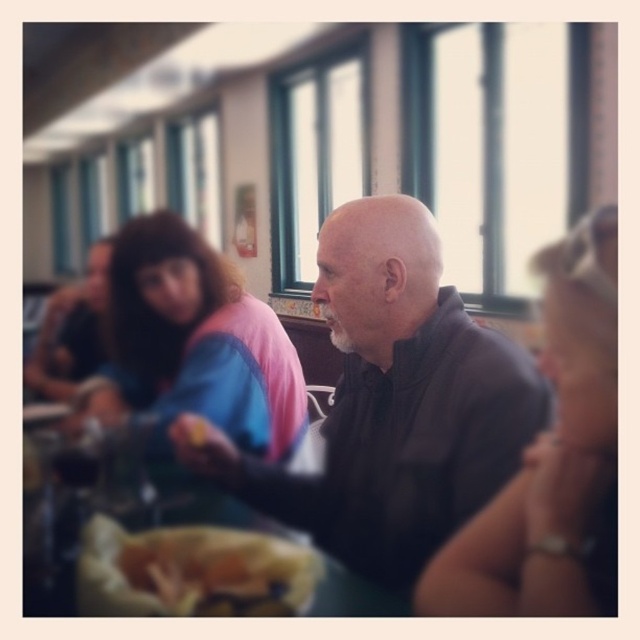
You are standing in a restaurant and want to place a small decoration exactly at the point marked as point (x=440, y=556). If your hand is 30 inches away from that point, will you be able to reach it without moving your hand closer?

The distance of point (x=440, y=556) from viewer is 35.57 inches. Since your hand is 30 inches away from the point, you need to move your hand 5.57 inches closer to reach it.

You are a waiter in a restaurant. You need to place a 30 cm long tray between the dark brown leather jacket at center and the golden crispy bread at center. Can you fit the tray there?

The distance between the dark brown leather jacket at center and the golden crispy bread at center is 25.25 centimeters, which is shorter than the 30 cm tray. Therefore, the tray cannot fit in that space.

Based on the photo, you are a photographer trying to capture a closeup of the golden crispy bread at center. However, the dark brown leather jacket at center is blocking your view. Can you move the jacket to get a clear shot of the bread?

The dark brown leather jacket at center is further to the viewer than golden crispy bread at center, so moving the jacket would allow you to see the bread behind it.